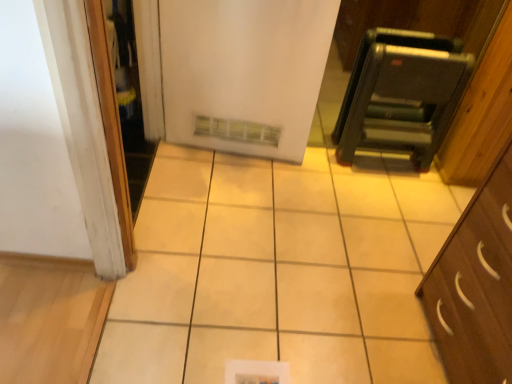
Question: Considering the relative sizes of white glossy screen door at left and metallic black step ladder at upper right in the image provided, is white glossy screen door at left taller than metallic black step ladder at upper right?

Choices:
 (A) yes
 (B) no

Answer: (A)

Question: Could you tell me if white glossy screen door at left is facing metallic black step ladder at upper right?

Choices:
 (A) yes
 (B) no

Answer: (A)

Question: Considering the relative sizes of white glossy screen door at left and metallic black step ladder at upper right in the image provided, is white glossy screen door at left thinner than metallic black step ladder at upper right?

Choices:
 (A) yes
 (B) no

Answer: (A)

Question: Considering the relative sizes of white glossy screen door at left and metallic black step ladder at upper right in the image provided, is white glossy screen door at left bigger than metallic black step ladder at upper right?

Choices:
 (A) yes
 (B) no

Answer: (B)

Question: Is white glossy screen door at left next to metallic black step ladder at upper right and touching it?

Choices:
 (A) no
 (B) yes

Answer: (A)

Question: From a real-world perspective, is white glossy screen door at left positioned over metallic black step ladder at upper right based on gravity?

Choices:
 (A) no
 (B) yes

Answer: (B)

Question: Considering the relative positions of metallic black step ladder at upper right and white glossy screen door at left in the image provided, is metallic black step ladder at upper right to the left of white glossy screen door at left from the viewer's perspective?

Choices:
 (A) yes
 (B) no

Answer: (B)

Question: Does metallic black step ladder at upper right have a greater height compared to white glossy screen door at left?

Choices:
 (A) no
 (B) yes

Answer: (A)

Question: Is white glossy screen door at left inside metallic black step ladder at upper right?

Choices:
 (A) yes
 (B) no

Answer: (B)

Question: From the image's perspective, is metallic black step ladder at upper right over white glossy screen door at left?

Choices:
 (A) yes
 (B) no

Answer: (A)

Question: Could you tell me if metallic black step ladder at upper right is turned towards white glossy screen door at left?

Choices:
 (A) yes
 (B) no

Answer: (B)

Question: Can you see metallic black step ladder at upper right touching white glossy screen door at left?

Choices:
 (A) yes
 (B) no

Answer: (B)

Question: From a real-world perspective, does white matte refrigerator at center stand above metallic black step ladder at upper right?

Choices:
 (A) yes
 (B) no

Answer: (A)